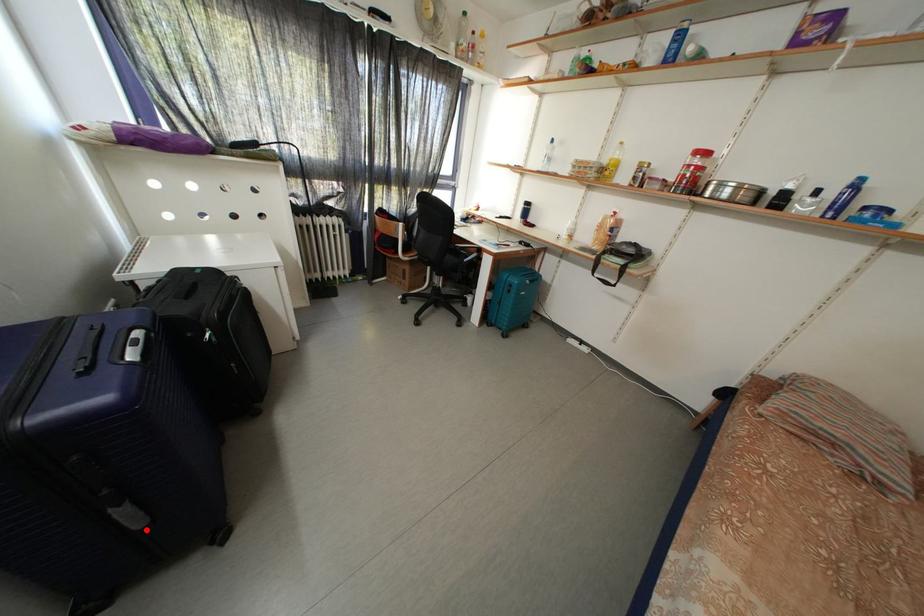
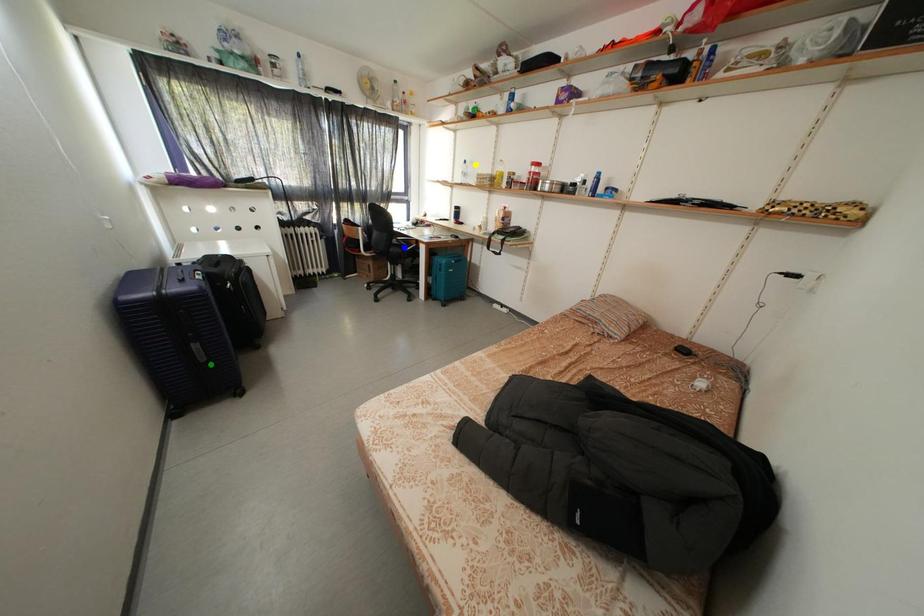
Question: I am providing you with two images of the same scene from different viewpoints. A red point is marked on the first image. You are given multiple points on the second image. Which point in image 2 is actually the same real-world point as the red point in image 1?

Choices:
 (A) green point
 (B) blue point
 (C) yellow point

Answer: (A)